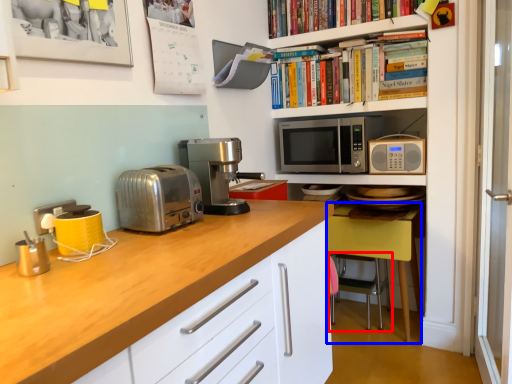
Question: Which point is further to the camera, chair (highlighted by a red box) or chair (highlighted by a blue box)?

Choices:
 (A) chair
 (B) chair

Answer: (A)